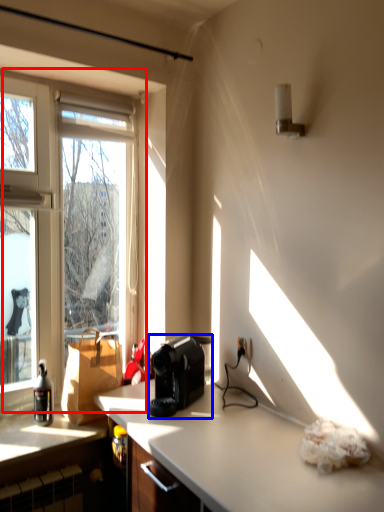
Question: Among these objects, which one is farthest to the camera, window (highlighted by a red box) or coffee maker (highlighted by a blue box)?

Choices:
 (A) window
 (B) coffee maker

Answer: (A)